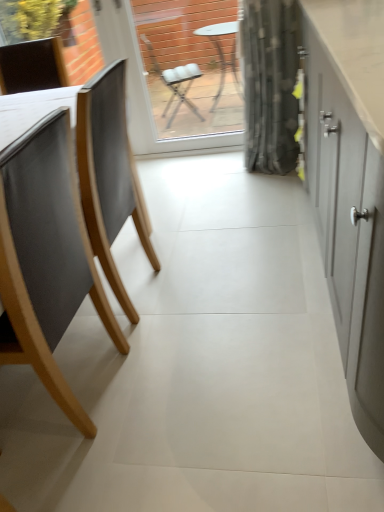
Where is `free space in front of matte wood chair at left`? free space in front of matte wood chair at left is located at coordinates coord(115,478).